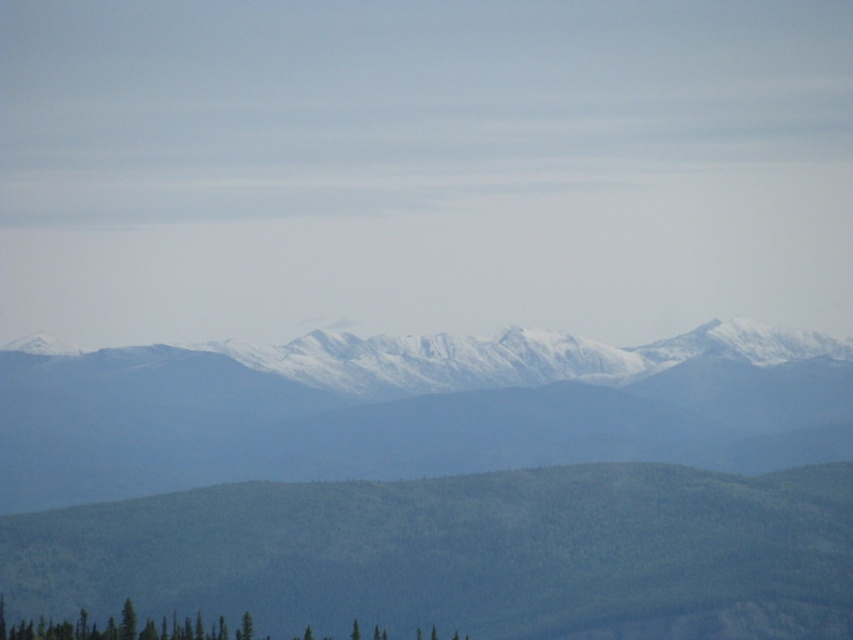
Consider the image. Does snowy mountain range at center have a larger size compared to green textured trees at lower left?

Correct, snowy mountain range at center is larger in size than green textured trees at lower left.

Can you confirm if snowy mountain range at center is positioned above green textured trees at lower left?

Indeed, snowy mountain range at center is positioned over green textured trees at lower left.

Which is behind, point (39, 406) or point (3, 596)?

Positioned behind is point (3, 596).

This screenshot has width=853, height=640. In order to click on snowy mountain range at center in this screenshot , I will do `click(410, 408)`.